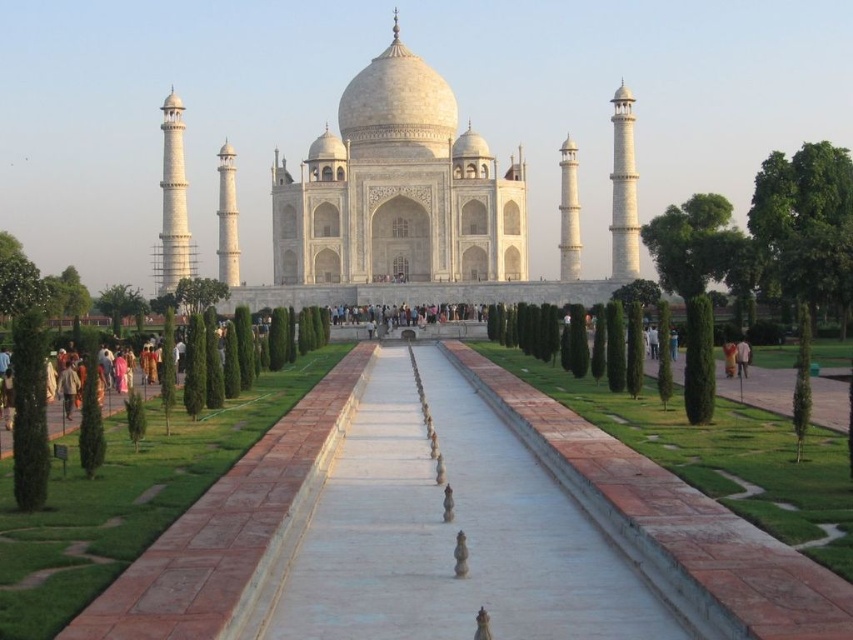
You are standing in front of the Taj Mahal and want to take a photo. You notice two points marked in the scene. The first point is at coordinates point (375, 67) and the second is at point (676, 333). Which point is closer to you?

Point (375, 67) is closer to you because it is further to the viewer than point (676, 333).

You are standing in front of the Taj Mahal and notice a smooth stone pathway at center and a yellow cotton shirt at center. Which object is larger in size?

The smooth stone pathway at center is bigger than the yellow cotton shirt at center.

You are planning to take a photo of the white marble Taj Mahal at center and the dark blue fabric at center. Which object should you focus on if you want to capture the wider subject in your shot?

The white marble Taj Mahal at center is wider than the dark blue fabric at center, so you should focus on the white marble Taj Mahal at center to capture the wider subject.